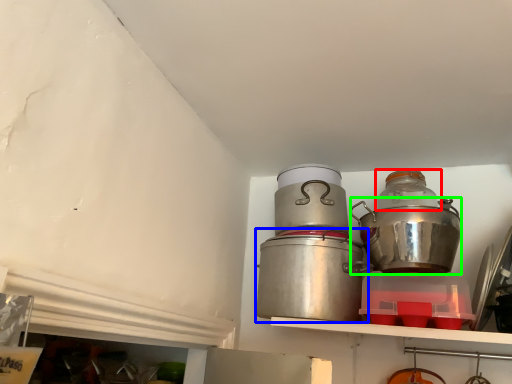
Question: Which object is the farthest from bottle (highlighted by a red box)? Choose among these: crock pot (highlighted by a blue box) or crock pot (highlighted by a green box).

Choices:
 (A) crock pot
 (B) crock pot

Answer: (A)